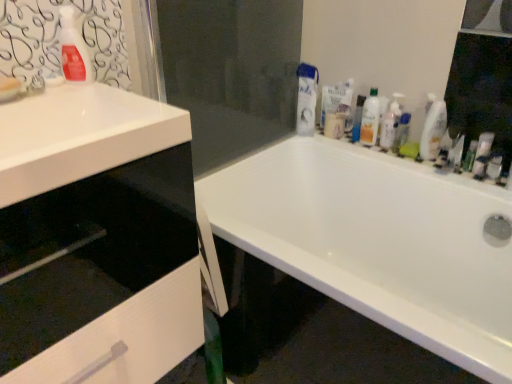
Question: From the image's perspective, relative to white matte fabric at upper right, which is the 1th cleaning product in back-to-front order, is white glossy bottle at upper right, marked as the second cleaning product in a front-to-back arrangement, above or below?

Choices:
 (A) above
 (B) below

Answer: (B)

Question: From a real-world perspective, relative to white matte fabric at upper right, positioned as the fifth cleaning product in front-to-back order, is white glossy bottle at upper right, placed as the 4th cleaning product when sorted from back to front, vertically above or below?

Choices:
 (A) below
 (B) above

Answer: (A)

Question: Based on their relative distances, which object is farther from the white matte fabric at upper right, positioned as the fifth cleaning product in front-to-back order?

Choices:
 (A) white glossy bathtub at center
 (B) transparent glass screen door at center
 (C) translucent plastic bottle at upper right, the third cleaning product when ordered from right to left
 (D) translucent plastic pump bottle at upper right, the third cleaning product viewed from the front
 (E) white glossy cabinet at left

Answer: (E)

Question: Which object is the farthest from the transparent glass screen door at center?

Choices:
 (A) green matte tube at right, positioned as the second toiletry in back-to-front order
 (B) white glossy cabinet at left
 (C) clear glass mirror at upper right
 (D) white matte fabric at upper right, which ranks as the fourth cleaning product in right-to-left order
 (E) white glossy bottle at upper right, acting as the fifth cleaning product starting from the left

Answer: (A)